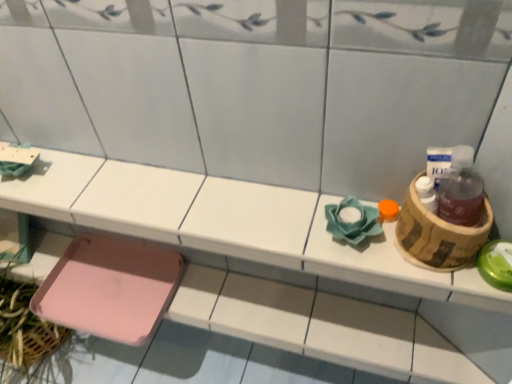
Question: Considering their positions, is pink plastic tray at lower left located in front of or behind pink plastic step stool at lower left?

Choices:
 (A) front
 (B) behind

Answer: (A)

Question: In terms of size, does pink plastic tray at lower left appear bigger or smaller than pink plastic step stool at lower left?

Choices:
 (A) small
 (B) big

Answer: (B)

Question: Estimate the real-world distances between objects in this image. Which object is farther from the pink plastic step stool at lower left?

Choices:
 (A) pink plastic tray at lower left
 (B) brown cardboard basket at right

Answer: (B)

Question: Considering the real-world distances, which object is closest to the pink plastic tray at lower left?

Choices:
 (A) brown cardboard basket at right
 (B) pink plastic step stool at lower left

Answer: (B)